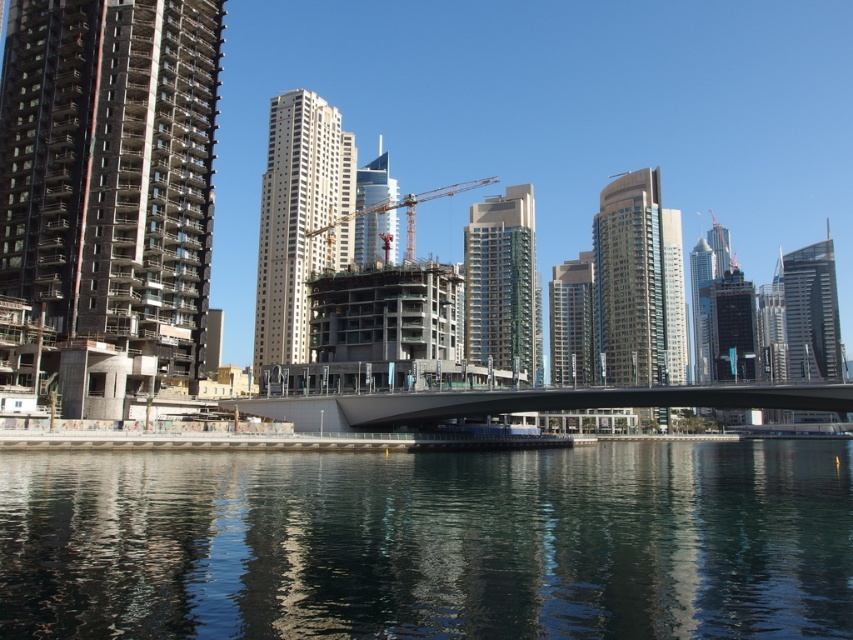
Can you confirm if white glass skyscraper at center is shorter than smooth concrete bridge at center?

Incorrect, white glass skyscraper at center's height does not fall short of smooth concrete bridge at center's.

Where is `white glass skyscraper at center`? This screenshot has height=640, width=853. white glass skyscraper at center is located at coordinates (299, 220).

Does point (340, 244) lie behind point (817, 387)?

Yes, point (340, 244) is behind point (817, 387).

At what (x,y) coordinates should I click in order to perform the action: click on white glass skyscraper at center. Please return your answer as a coordinate pair (x, y). Looking at the image, I should click on (299, 220).

Is dark reflective water at center positioned behind glassy reflective skyscraper at center?

No, it is in front of glassy reflective skyscraper at center.

The width and height of the screenshot is (853, 640). Find the location of `dark reflective water at center`. dark reflective water at center is located at coordinates (430, 541).

In the scene shown: Which is more to the right, dark reflective water at center or white glass skyscraper at center?

From the viewer's perspective, dark reflective water at center appears more on the right side.

Between dark reflective water at center and white glass skyscraper at center, which one appears on the left side from the viewer's perspective?

white glass skyscraper at center

I want to click on dark reflective water at center, so click(430, 541).